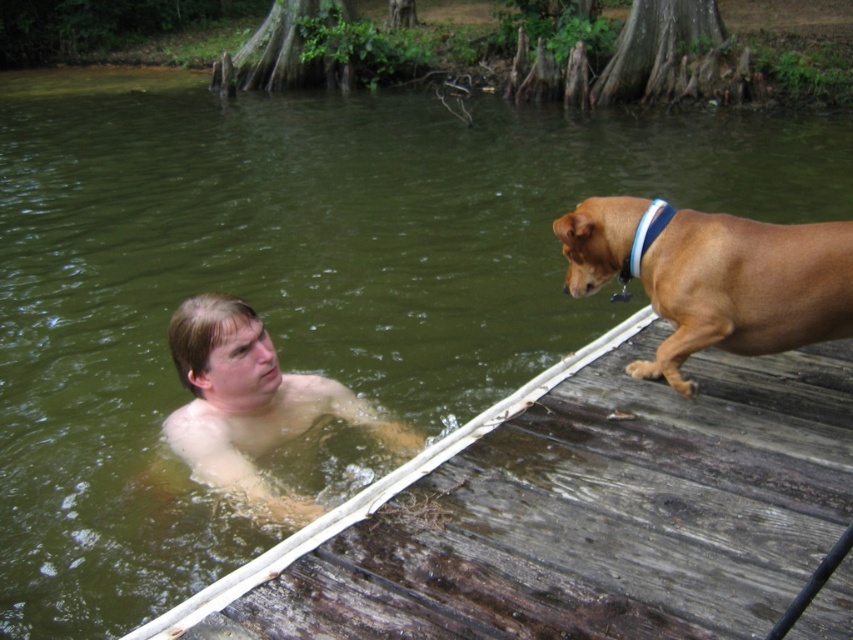
You are standing at the center of the image and want to walk towards the weathered wood dock at lower right. Which direction should you move to reach it?

Since the weathered wood dock at lower right is located at point (x=573, y=513) in the image, you should move towards the lower right direction to reach it.

In the scene shown: You are a person who is 6 feet tall and want to walk from the weathered wood dock at lower right to the brown smooth dog at right. Can you do this without getting your feet wet?

The distance between the weathered wood dock at lower right and the brown smooth dog at right is 23.49 inches, which is less than 6 feet. Therefore, you can walk from the weathered wood dock at lower right to the brown smooth dog at right without getting your feet wet.